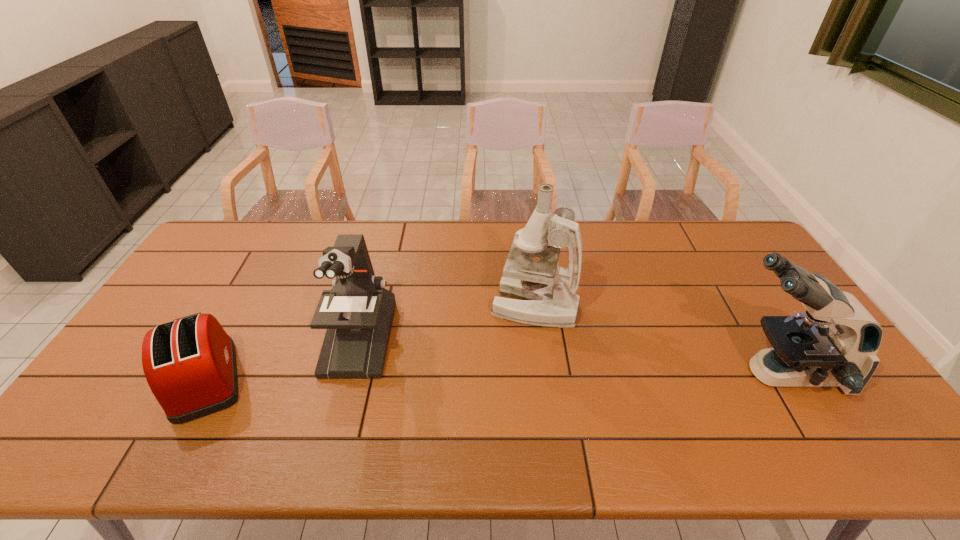
The height and width of the screenshot is (540, 960). What are the coordinates of `the third object from left to right` in the screenshot? It's located at (547, 290).

I want to click on the rightmost microscope, so click(835, 343).

Image resolution: width=960 pixels, height=540 pixels. Find the location of `the second object from left to right`. the second object from left to right is located at coordinates (358, 312).

At what (x,y) coordinates should I click in order to perform the action: click on toaster. Please return your answer as a coordinate pair (x, y). Looking at the image, I should click on (190, 365).

Identify the location of the shortest object. (190, 365).

Locate an element on the screen. vacant region located 0.080m on the back of the third object from left to right is located at coordinates (530, 270).

Where is `vacant space located 0.350m through the eyepieces of the rightmost object`? vacant space located 0.350m through the eyepieces of the rightmost object is located at coordinates (584, 373).

Identify the location of vacant space positioned 0.090m through the eyepieces of the rightmost object. (683, 373).

Locate an element on the screen. free region located 0.130m through the eyepieces of the rightmost object is located at coordinates (667, 373).

Find the location of a particular element. free location located 0.130m through the eyepieces of the second object from left to right is located at coordinates (335, 426).